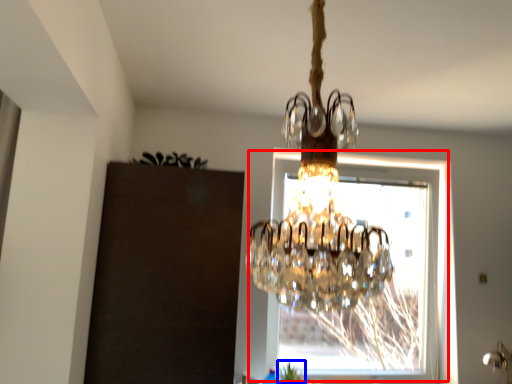
Question: Which object appears closest to the camera in this image, window (highlighted by a red box) or plant (highlighted by a blue box)?

Choices:
 (A) window
 (B) plant

Answer: (B)